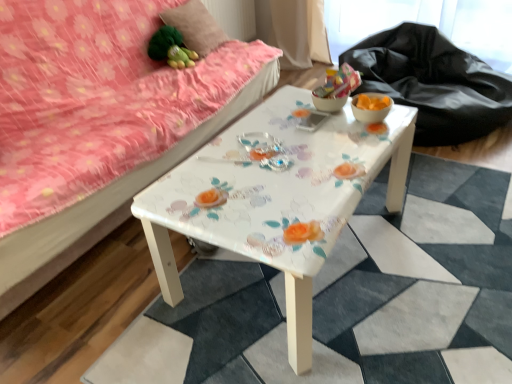
The image size is (512, 384). Identify the location of free space to the left of matte orange glass bowl at right, which is the 1th glass bowl from right to left. tap(323, 127).